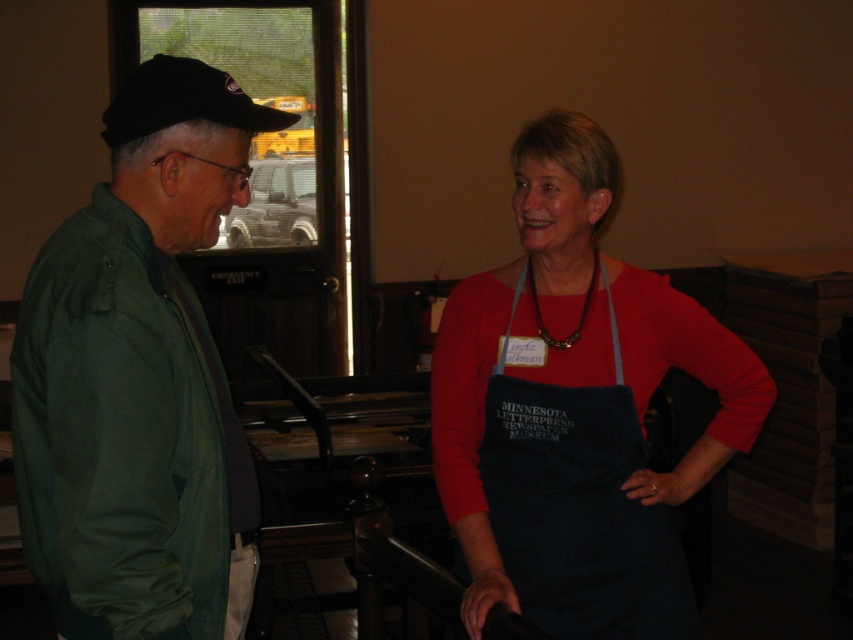
What are the coordinates of the green matte jacket at left in the image?

The green matte jacket at left is located at coordinates (138, 378).

You are standing in a museum and want to approach the point marked as point (105, 314). If you take a step forward of 2 feet, how far will you still be from the point?

After taking a 2 feet step forward, you will still be 2.55 feet away from point (105, 314) because the original distance was 4.55 feet.

You are standing in the museum and want to take a photo of the green matte jacket at left. Your camera is 4.42 feet away from the jacket. Is the camera within the recommended 5 feet distance for clear photos?

The camera is 4.42 feet away from the green matte jacket at left, which is within the recommended 5 feet distance for clear photos.